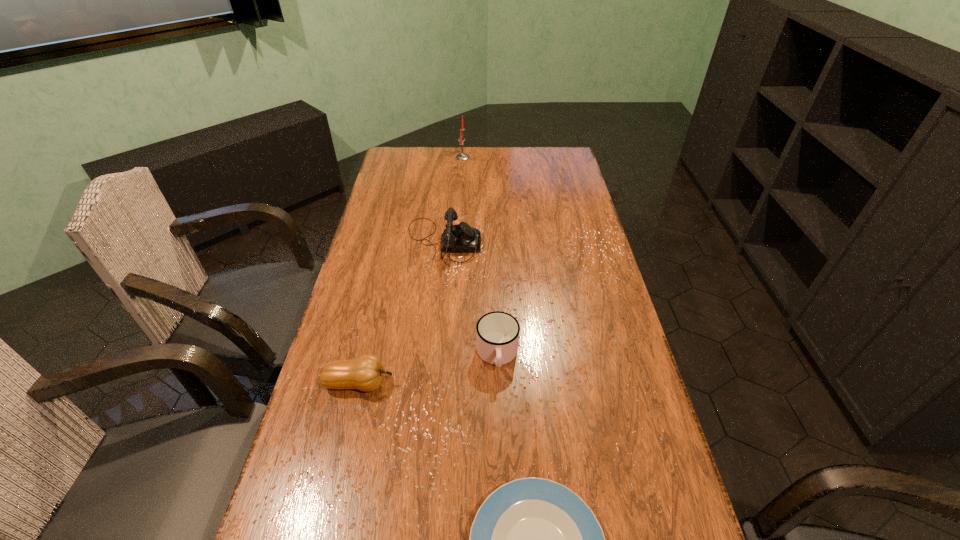
You are a GUI agent. You are given a task and a screenshot of the screen. Output one action in this format:
    pyautogui.click(x=<x>, y=<y>)
    Task: Click on the second closest object to the mug
    This screenshot has width=960, height=540.
    Given the screenshot: What is the action you would take?
    point(533,539)

Where is `vacant area that satisfies the following two spatial constraints: 1. on the side of the mug with the handle; 2. on the stem side of the gourd`? vacant area that satisfies the following two spatial constraints: 1. on the side of the mug with the handle; 2. on the stem side of the gourd is located at coordinates (498, 383).